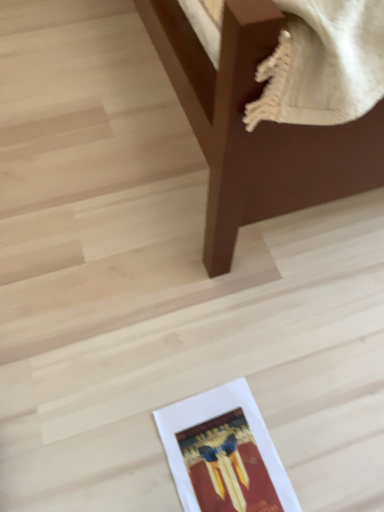
At what (x,y) coordinates should I click in order to perform the action: click on free space above matte paper paperback book at lower center (from a real-world perspective). Please return your answer as a coordinate pair (x, y). The height and width of the screenshot is (512, 384). Looking at the image, I should click on (220, 457).